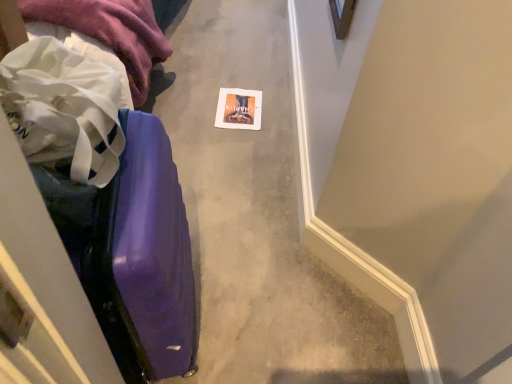
Question: Are purple glossy suitcase at left and white fabric at left located far from each other?

Choices:
 (A) no
 (B) yes

Answer: (A)

Question: Is purple glossy suitcase at left shorter than white fabric at left?

Choices:
 (A) yes
 (B) no

Answer: (B)

Question: Is purple glossy suitcase at left positioned with its back to white fabric at left?

Choices:
 (A) no
 (B) yes

Answer: (A)

Question: Does purple glossy suitcase at left have a greater width compared to white fabric at left?

Choices:
 (A) no
 (B) yes

Answer: (A)

Question: Considering the relative positions of purple glossy suitcase at left and white fabric at left in the image provided, is purple glossy suitcase at left in front of white fabric at left?

Choices:
 (A) no
 (B) yes

Answer: (B)

Question: Considering the relative positions of purple glossy suitcase at left and white fabric at left in the image provided, is purple glossy suitcase at left behind white fabric at left?

Choices:
 (A) yes
 (B) no

Answer: (B)

Question: Can you confirm if purple glossy suitcase at left is bigger than matte paper postcard at center?

Choices:
 (A) no
 (B) yes

Answer: (B)

Question: Does purple glossy suitcase at left turn towards matte paper postcard at center?

Choices:
 (A) no
 (B) yes

Answer: (A)

Question: Is purple glossy suitcase at left positioned in front of matte paper postcard at center?

Choices:
 (A) no
 (B) yes

Answer: (B)

Question: Is matte paper postcard at center a part of purple glossy suitcase at left?

Choices:
 (A) no
 (B) yes

Answer: (A)

Question: Can we say purple glossy suitcase at left lies outside matte paper postcard at center?

Choices:
 (A) no
 (B) yes

Answer: (B)

Question: From a real-world perspective, is purple glossy suitcase at left on top of matte paper postcard at center?

Choices:
 (A) no
 (B) yes

Answer: (B)

Question: Does matte paper postcard at center have a larger size compared to purple glossy suitcase at left?

Choices:
 (A) no
 (B) yes

Answer: (A)